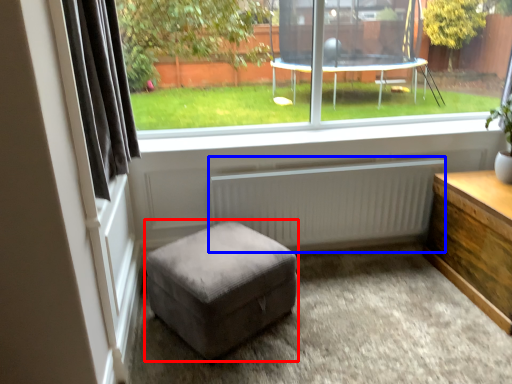
Question: Which object is closer to the camera taking this photo, stool (highlighted by a red box) or radiator (highlighted by a blue box)?

Choices:
 (A) stool
 (B) radiator

Answer: (A)